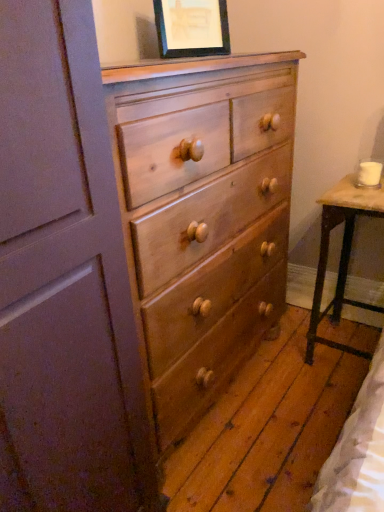
Question: Choose the correct answer: Is light brown wood chest of drawers at center inside matte black picture frame at upper center or outside it?

Choices:
 (A) outside
 (B) inside

Answer: (A)

Question: In the image, is light brown wood chest of drawers at center positioned in front of or behind matte black picture frame at upper center?

Choices:
 (A) behind
 (B) front

Answer: (B)

Question: Estimate the real-world distances between objects in this image. Which object is farther from the wooden table at right?

Choices:
 (A) matte black picture frame at upper center
 (B) light brown wood chest of drawers at center

Answer: (A)

Question: Which is nearer to the light brown wood chest of drawers at center?

Choices:
 (A) wooden table at right
 (B) matte black picture frame at upper center

Answer: (A)